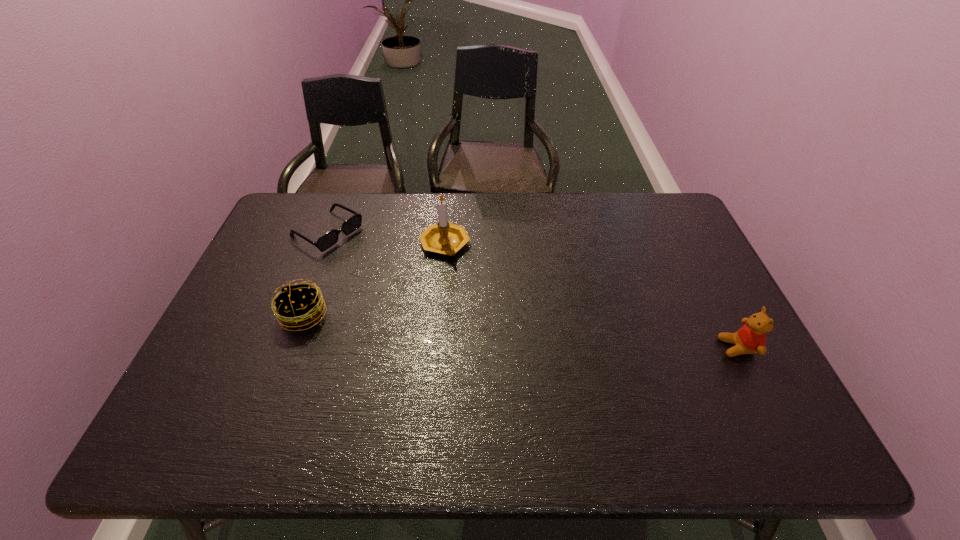
The image size is (960, 540). I want to click on free point located with a handle on the candle holder, so click(541, 323).

You are a GUI agent. You are given a task and a screenshot of the screen. Output one action in this format:
    pyautogui.click(x=<x>, y=<y>)
    Task: Click on the free space located 0.190m with a handle on the candle holder
    This screenshot has width=960, height=540.
    Given the screenshot: What is the action you would take?
    pyautogui.click(x=505, y=294)

Where is `vacant space located 0.400m with a handle on the candle holder`? Image resolution: width=960 pixels, height=540 pixels. vacant space located 0.400m with a handle on the candle holder is located at coordinates (562, 339).

Locate an element on the screen. Image resolution: width=960 pixels, height=540 pixels. vacant space located 0.240m on the front-facing side of the sunglasses is located at coordinates pos(407,278).

Locate an element on the screen. The width and height of the screenshot is (960, 540). vacant space located on the front-facing side of the sunglasses is located at coordinates (383, 264).

The height and width of the screenshot is (540, 960). What are the coordinates of `vacant space situated 0.300m on the front-facing side of the sunglasses` in the screenshot? It's located at (422, 287).

This screenshot has width=960, height=540. In order to click on candle holder located at the far edge in this screenshot , I will do `click(446, 238)`.

Find the location of a particular element. This screenshot has height=540, width=960. sunglasses located in the far edge section of the desktop is located at coordinates (329, 239).

I want to click on patty at the left edge, so click(298, 306).

Find the location of a particular element. The width and height of the screenshot is (960, 540). sunglasses positioned at the left edge is located at coordinates (329, 239).